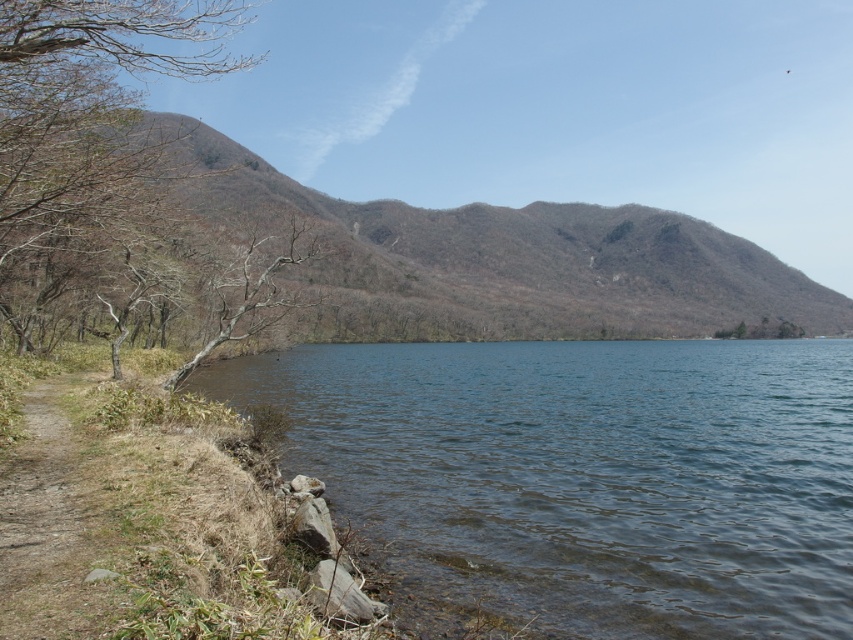
Question: Which of the following is the farthest from the observer?

Choices:
 (A) (0, 600)
 (B) (195, 36)

Answer: (B)

Question: Can you confirm if brown textured mountain at center is wider than brown dirt path at lower left?

Choices:
 (A) no
 (B) yes

Answer: (B)

Question: Can you confirm if brown leafless tree at left is positioned to the right of brown dirt path at lower left?

Choices:
 (A) no
 (B) yes

Answer: (A)

Question: Which point appears farthest from the camera in this image?

Choices:
 (A) (24, 17)
 (B) (799, 492)
 (C) (15, 524)

Answer: (B)

Question: Which point is farther from the camera taking this photo?

Choices:
 (A) (83, 449)
 (B) (439, 216)
 (C) (223, 330)
 (D) (525, 580)

Answer: (B)

Question: Is clear water at shore left to the left of brown leafless tree at left from the viewer's perspective?

Choices:
 (A) yes
 (B) no

Answer: (B)